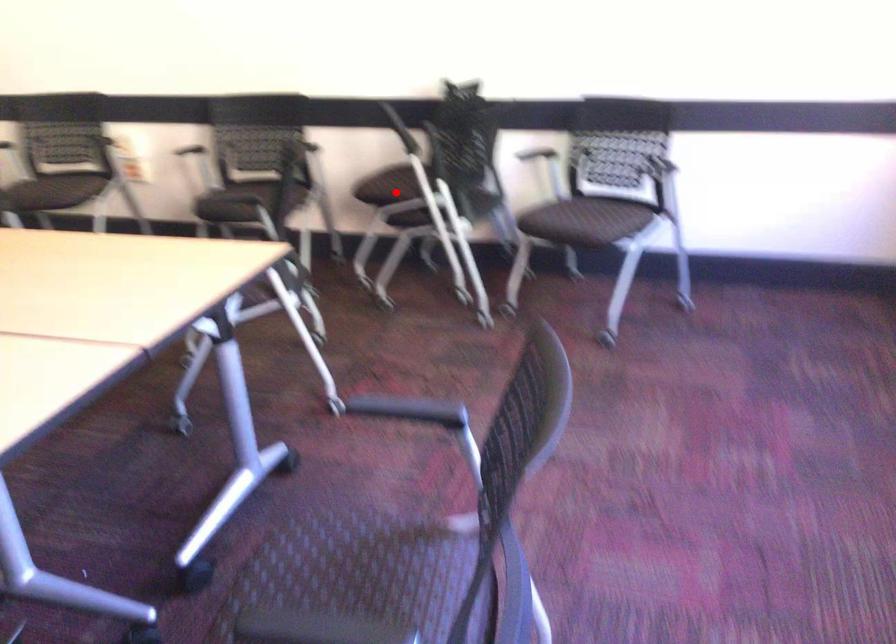
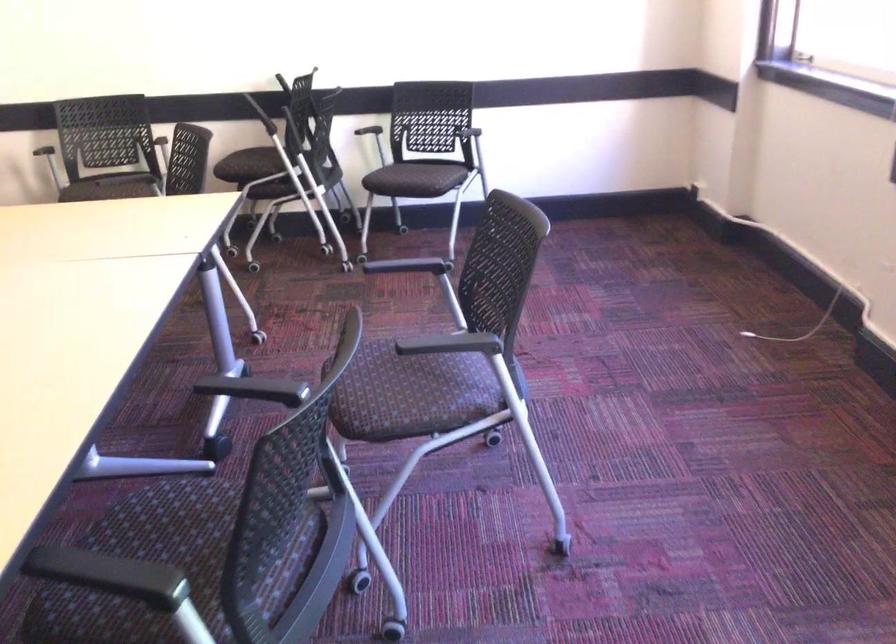
Locate, in the second image, the point that corresponds to the highlighted location in the first image.

(252, 166)